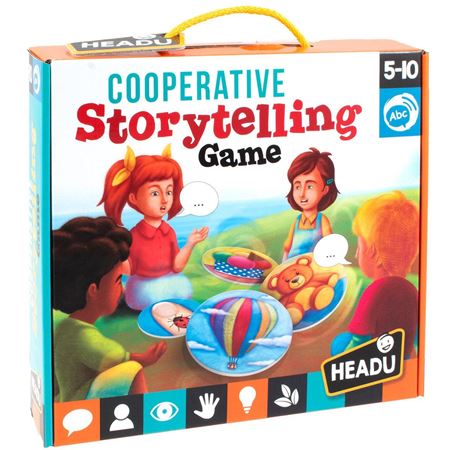
Where is `teddy bear`? The image size is (450, 450). teddy bear is located at coordinates (309, 269).